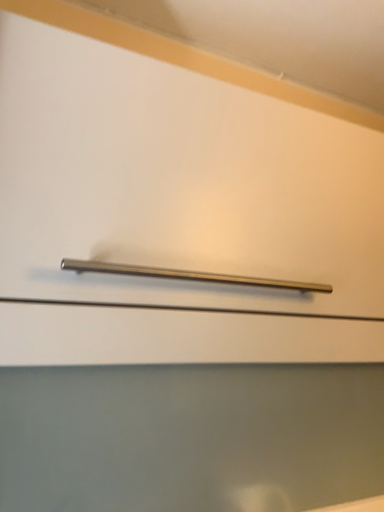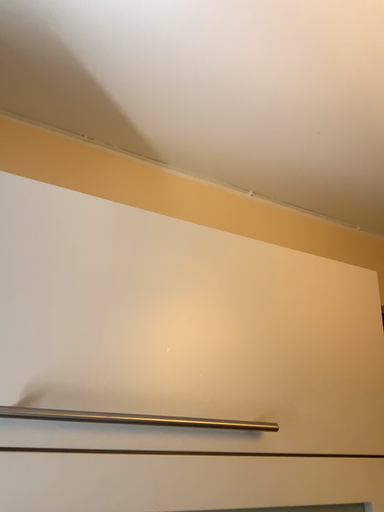
Question: Which way did the camera rotate in the video?

Choices:
 (A) rotated downward
 (B) rotated upward

Answer: (B)